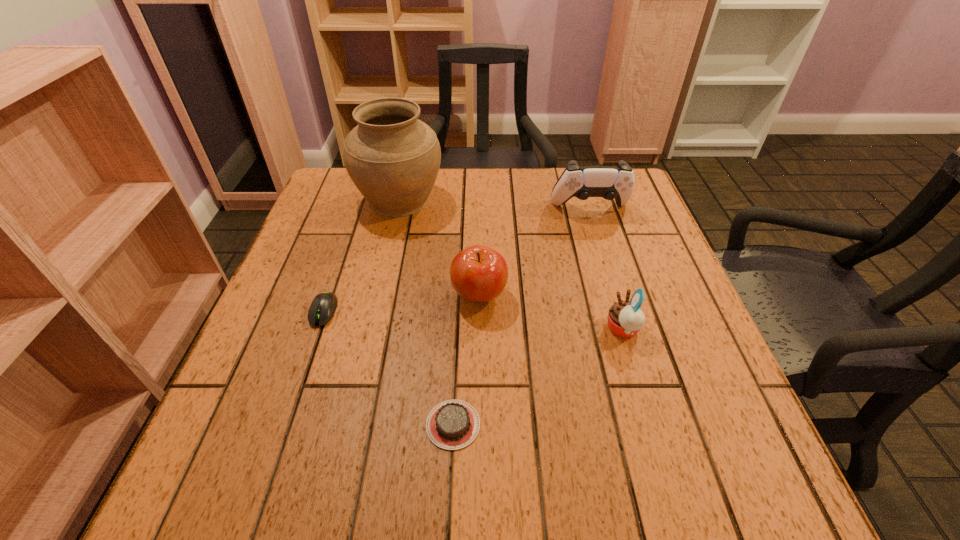
Locate an element on the screen. This screenshot has width=960, height=540. control that is at the right edge is located at coordinates (609, 182).

The width and height of the screenshot is (960, 540). In order to click on muffin that is at the right edge in this screenshot , I will do `click(625, 318)`.

In order to click on object situated at the far left corner in this screenshot , I will do `click(393, 158)`.

Locate an element on the screen. object situated at the far right corner is located at coordinates pyautogui.click(x=609, y=182).

Locate an element on the screen. This screenshot has width=960, height=540. free space at the near edge is located at coordinates (437, 464).

At what (x,y) coordinates should I click in order to perform the action: click on free space at the left edge of the desktop. Please return your answer as a coordinate pair (x, y). The image size is (960, 540). Looking at the image, I should click on (279, 424).

In the image, there is a desktop. In order to click on vacant area at the right edge in this screenshot , I will do `click(689, 379)`.

Locate an element on the screen. The width and height of the screenshot is (960, 540). vacant space at the near left corner of the desktop is located at coordinates (209, 449).

At what (x,y) coordinates should I click in order to perform the action: click on vacant space at the far right corner of the desktop. Please return your answer as a coordinate pair (x, y). This screenshot has height=540, width=960. Looking at the image, I should click on (636, 211).

Identify the location of vacant space at the near right corner of the desktop. (729, 482).